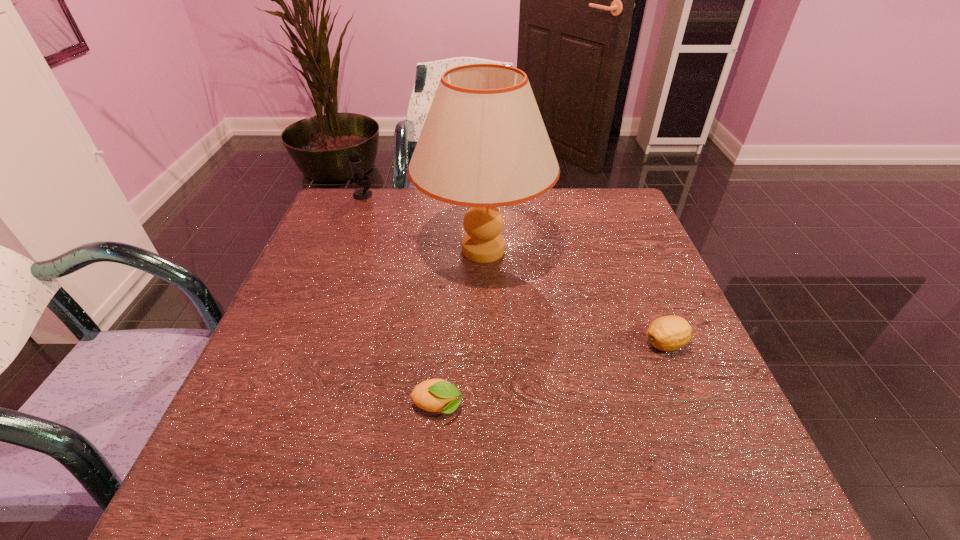
Where is `vacant space that is in between the nearest object and the farthest object`? vacant space that is in between the nearest object and the farthest object is located at coordinates tap(400, 301).

You are a GUI agent. You are given a task and a screenshot of the screen. Output one action in this format:
    pyautogui.click(x=<x>, y=<y>)
    Task: Click on the free point between the lampshade and the third shortest object
    This screenshot has height=540, width=960.
    Given the screenshot: What is the action you would take?
    pyautogui.click(x=423, y=222)

At what (x,y) coordinates should I click in order to perform the action: click on free space between the second farthest object and the nearest object. Please return your answer as a coordinate pair (x, y). Looking at the image, I should click on (461, 328).

The image size is (960, 540). I want to click on vacant space that's between the farther lemon and the tallest object, so click(x=574, y=297).

This screenshot has height=540, width=960. In order to click on free point between the third shortest object and the rightmost object in this screenshot , I will do `click(515, 269)`.

Point out which object is positioned as the third nearest to the third farthest object. Please provide its 2D coordinates. Your answer should be formatted as a tuple, i.e. [(x, y)], where the tuple contains the x and y coordinates of a point satisfying the conditions above.

[(356, 167)]

Find the location of `object that stands as the closest to the nearest object`. object that stands as the closest to the nearest object is located at coordinates (483, 145).

At what (x,y) coordinates should I click in order to perform the action: click on free region that satisfies the following two spatial constraints: 1. on the front side of the second tallest object; 2. on the right side of the third nearest object. Please return your answer as a coordinate pair (x, y). This screenshot has height=540, width=960. Looking at the image, I should click on (342, 250).